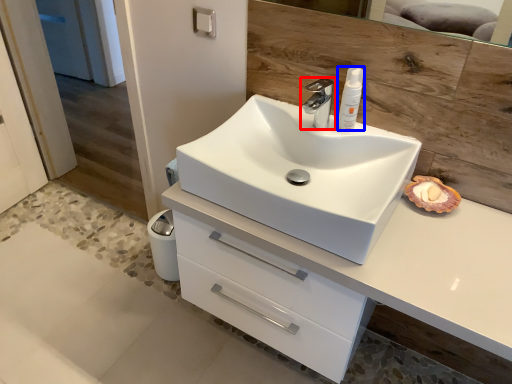
Question: Which of the following is the closest to the observer, tap (highlighted by a red box) or toiletry (highlighted by a blue box)?

Choices:
 (A) tap
 (B) toiletry

Answer: (A)